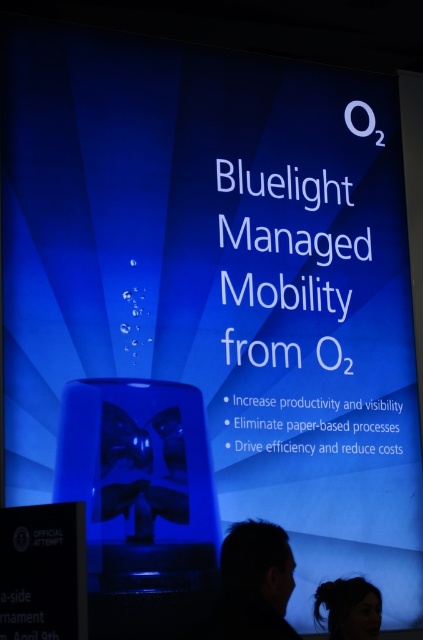
Question: Which point is closer to the camera?

Choices:
 (A) black matte hair at lower left
 (B) dark brown hair at lower center

Answer: (A)

Question: Is black matte hair at lower left above dark brown hair at lower center?

Choices:
 (A) no
 (B) yes

Answer: (B)

Question: Which point appears closest to the camera in this image?

Choices:
 (A) (356, 598)
 (B) (282, 625)

Answer: (B)

Question: Can you confirm if black matte hair at lower left is positioned below dark brown hair at lower center?

Choices:
 (A) yes
 (B) no

Answer: (B)

Question: Observing the image, what is the correct spatial positioning of black matte hair at lower left in reference to dark brown hair at lower center?

Choices:
 (A) below
 (B) above

Answer: (B)